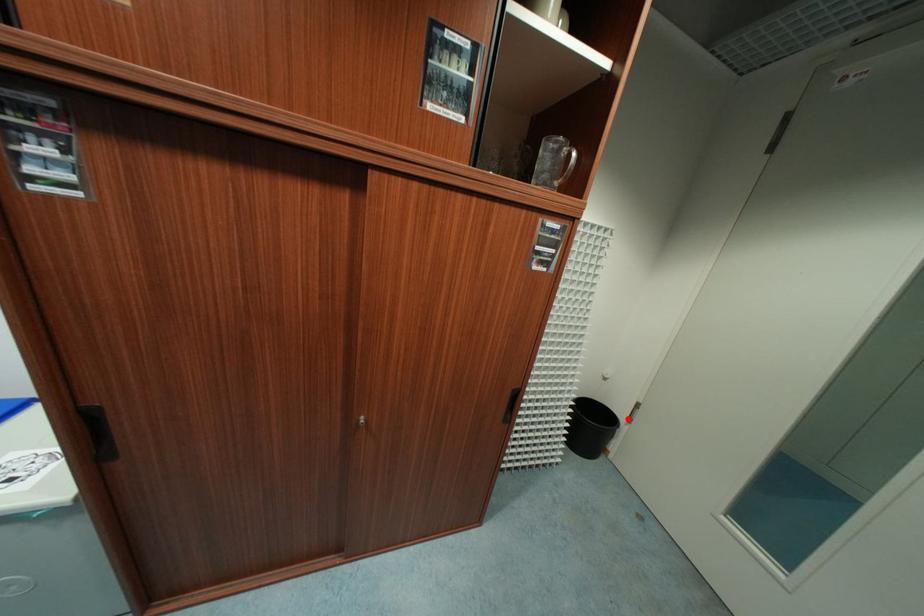
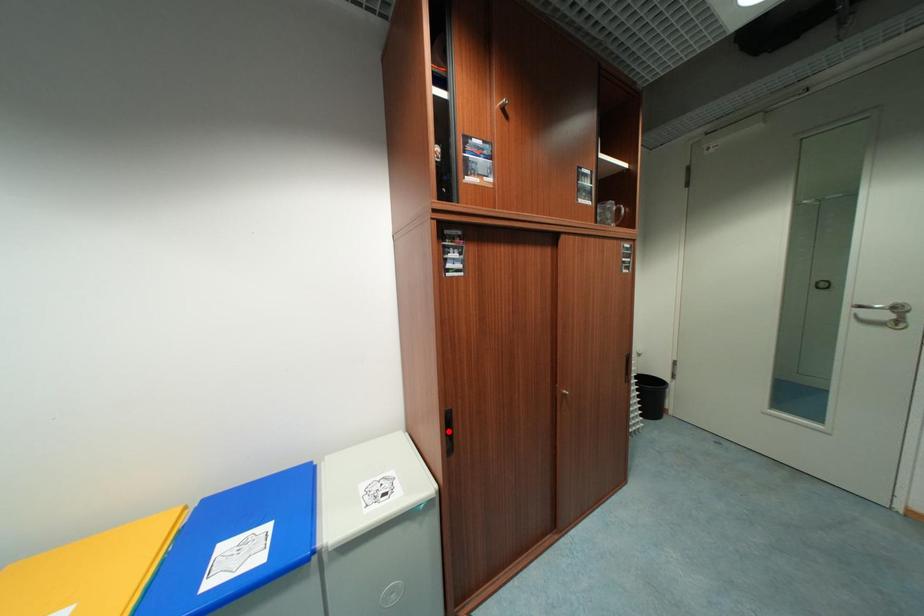
I am providing you with two images of the same scene from different viewpoints. A red point is marked on the first image and another point is marked on the second image. Are the points marked in image1 and image2 representing the same 3D position?

No